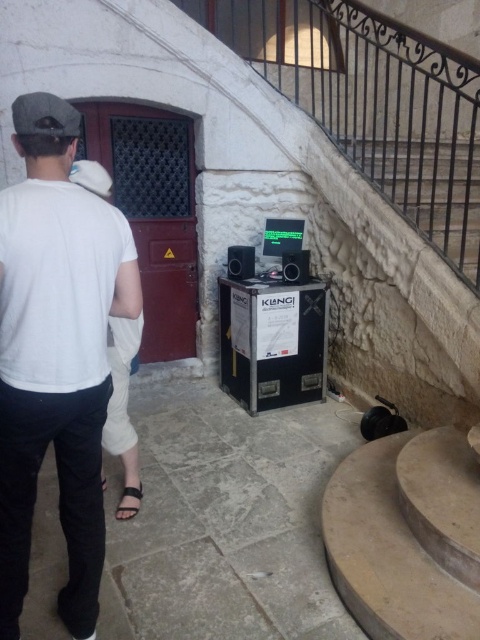
You are a security camera monitoring the scene. You observe the white cotton shirt at upper left and the black leather sandal at lower left. Which object is positioned more to the left side of the frame?

The white cotton shirt at upper left is positioned more to the left of the frame than the black leather sandal at lower left.

You are a fashion designer observing the scene. You notice the white cotton shirt at upper left and the black leather sandal at lower left. Which object has a greater width?

The white cotton shirt at upper left has a greater width than the black leather sandal at lower left.

Based on the provided scene description, what are the coordinates of the white cotton shirt at upper left?

The white cotton shirt at upper left is located at coordinates point (56, 355).